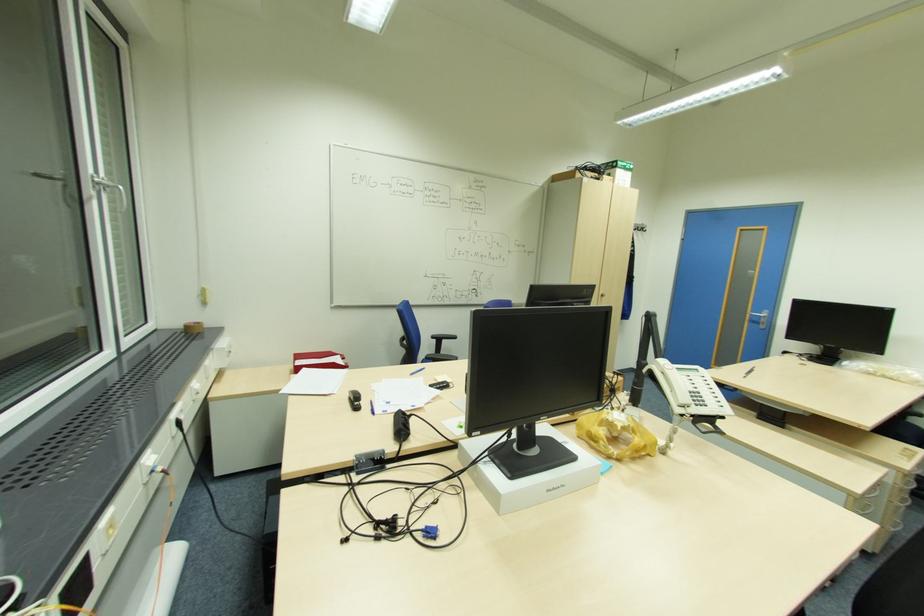
Find where to lift the red document holder. Please return your answer as a coordinate pair (x, y).

(319, 360)